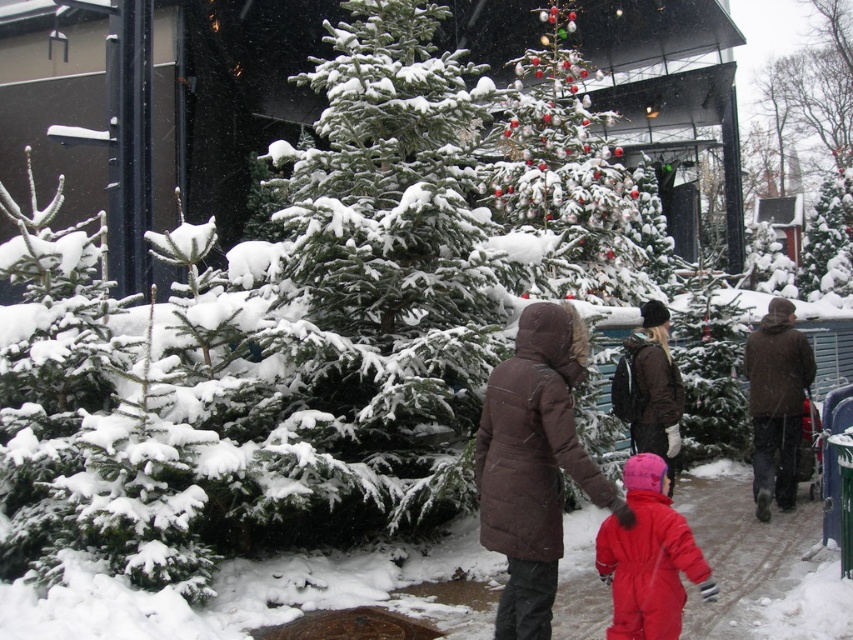
Question: Is brown woolen jacket at center-right above dark brown puffer coat at center?

Choices:
 (A) no
 (B) yes

Answer: (A)

Question: Can you confirm if green snowy christmas tree at center is smaller than dark brown puffer coat at center?

Choices:
 (A) no
 (B) yes

Answer: (A)

Question: Estimate the real-world distances between objects in this image. Which object is closer to the brown puffy coat at center?

Choices:
 (A) red snowsuit at center
 (B) green snowy christmas tree at center
 (C) brown woolen jacket at center-right
 (D) dark brown puffer coat at center

Answer: (A)

Question: Among these points, which one is farthest from the camera?

Choices:
 (A) (674, 401)
 (B) (467, 352)
 (C) (782, 452)

Answer: (C)

Question: Which point appears closest to the camera in this image?

Choices:
 (A) (642, 388)
 (B) (788, 336)

Answer: (A)

Question: Is brown puffy coat at center closer to the viewer compared to dark brown puffer coat at center?

Choices:
 (A) no
 (B) yes

Answer: (B)